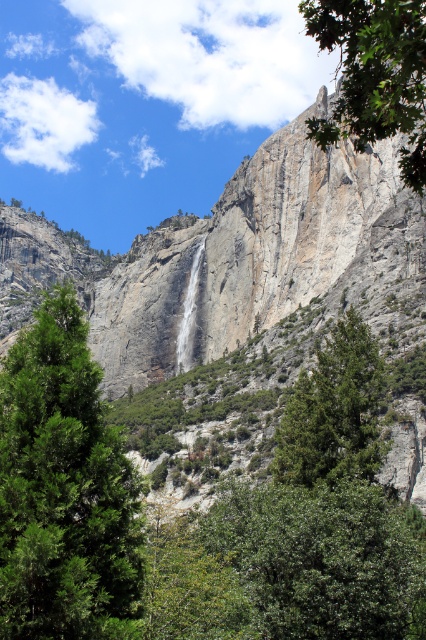
Question: Observing the image, what is the correct spatial positioning of green leafy tree at center in reference to green leafy tree at upper right?

Choices:
 (A) below
 (B) above

Answer: (A)

Question: Which point appears closest to the camera in this image?

Choices:
 (A) (204, 240)
 (B) (386, 93)

Answer: (B)

Question: Which of the following is the farthest from the observer?

Choices:
 (A) green textured tree at center
 (B) green leafy tree at upper right
 (C) gray rock cliff at center

Answer: (C)

Question: Which point appears farthest from the camera in this image?

Choices:
 (A) (58, 401)
 (B) (268, 237)

Answer: (B)

Question: Is gray rock cliff at center above white smooth waterfall at center?

Choices:
 (A) no
 (B) yes

Answer: (B)

Question: Is gray rock cliff at center above green textured tree at center?

Choices:
 (A) yes
 (B) no

Answer: (A)